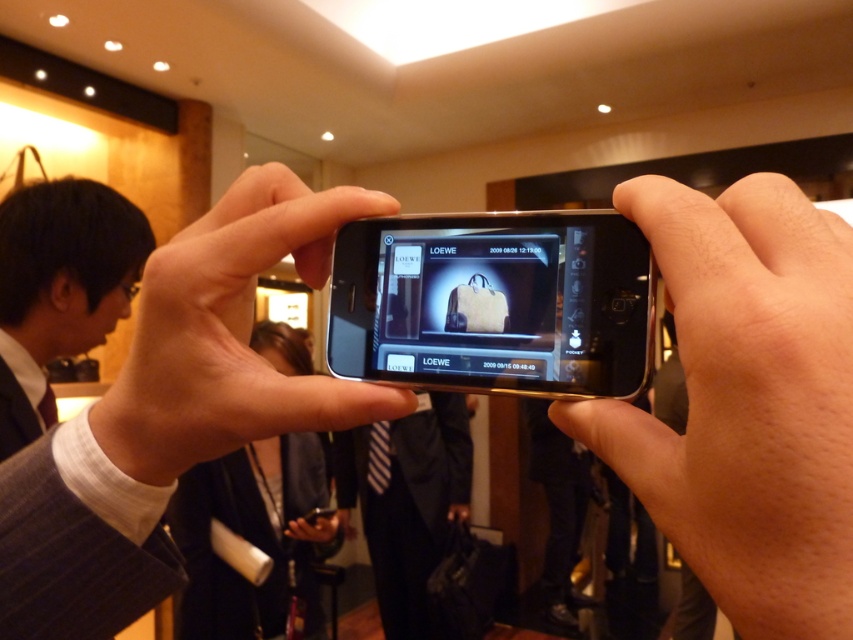
You are a photographer trying to capture the LOEWE garment displayed on the smartphone screen. Since both the satin black smartphone at center and the black fabric suit at center are in the frame, which object should you focus on to ensure the garment is clearly visible?

The satin black smartphone at center is in front of the black fabric suit at center, so focusing on the smartphone will ensure the LOEWE garment on its screen is clearly visible without obstruction from the suit.

You are a photographer trying to focus on the two points in the image. Which point is closer to the camera, point (431, 292) or point (32, 200)?

Point (431, 292) is in front of point (32, 200), so it is closer to the camera.

You are a fashion designer who wants to place a satin gold phone at center on top of the black suit at left. Based on the scene description, will the phone fit on the suit without hanging over the edges?

The satin gold phone at center is shorter in height than the black suit at left. Therefore, the phone will fit on the suit without hanging over the edges.